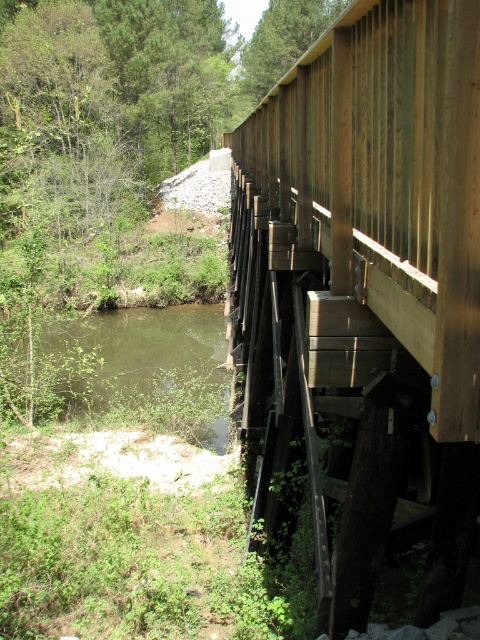
You are standing at point [477,52] and want to cross the wooden bridge to reach the other side. The bridge is 1.33 meters wide. Can you walk across it safely if you are 0.5 meters wide?

The bridge is 1.33 meters wide, which is wider than your 0.5 meters width, so yes, you can walk across it safely.

You are standing on the wooden bridge at right and want to look down at the green murky water at lower left. Will you need to lower your head to see it?

The wooden bridge at right is higher than the green murky water at lower left, so yes, you will need to lower your head to see it.